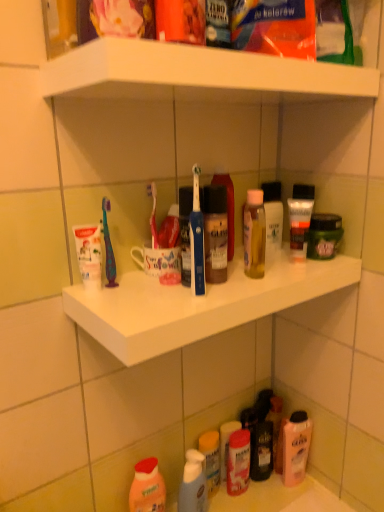
Question: From a real-world perspective, is translucent plastic spray bottle at lower center, the fourth toiletry when ordered from top to bottom, positioned over translucent plastic tube at upper center, positioned as the first toiletry in top-to-bottom order, based on gravity?

Choices:
 (A) no
 (B) yes

Answer: (A)

Question: Does translucent plastic spray bottle at lower center, the fourth toiletry when ordered from top to bottom, have a lesser height compared to translucent plastic tube at upper center, the third toiletry from the left?

Choices:
 (A) yes
 (B) no

Answer: (B)

Question: Does translucent plastic spray bottle at lower center, the first toiletry in the left-to-right sequence, have a smaller size compared to translucent plastic tube at upper center, the 2th toiletry in the right-to-left sequence?

Choices:
 (A) no
 (B) yes

Answer: (A)

Question: Is translucent plastic spray bottle at lower center, which is the fourth toiletry in right-to-left order, aimed at translucent plastic tube at upper center, positioned as the 4th toiletry in bottom-to-top order?

Choices:
 (A) yes
 (B) no

Answer: (B)

Question: Would you say translucent plastic spray bottle at lower center, the fourth toiletry when ordered from top to bottom, is outside translucent plastic tube at upper center, the third toiletry from the left?

Choices:
 (A) no
 (B) yes

Answer: (B)

Question: Is translucent plastic spray bottle at lower center, the fourth toiletry when ordered from top to bottom, bigger than translucent plastic tube at upper center, positioned as the 4th toiletry in bottom-to-top order?

Choices:
 (A) no
 (B) yes

Answer: (B)

Question: Can you confirm if translucent plastic tube at upper center, positioned as the 4th toiletry in bottom-to-top order, is bigger than translucent plastic spray bottle at lower center, the fourth toiletry when ordered from top to bottom?

Choices:
 (A) no
 (B) yes

Answer: (A)

Question: Does translucent plastic tube at upper center, the 2th toiletry in the right-to-left sequence, touch translucent plastic spray bottle at lower center, which is the fourth toiletry in right-to-left order?

Choices:
 (A) no
 (B) yes

Answer: (A)

Question: Is translucent plastic tube at upper center, the third toiletry from the left, positioned with its back to translucent plastic spray bottle at lower center, the fourth toiletry when ordered from top to bottom?

Choices:
 (A) no
 (B) yes

Answer: (A)

Question: Is translucent plastic tube at upper center, positioned as the 4th toiletry in bottom-to-top order, further to camera compared to translucent plastic spray bottle at lower center, the 1th toiletry in the bottom-to-top sequence?

Choices:
 (A) yes
 (B) no

Answer: (B)

Question: Is translucent plastic tube at upper center, the 2th toiletry in the right-to-left sequence, positioned in front of translucent plastic spray bottle at lower center, the first toiletry in the left-to-right sequence?

Choices:
 (A) no
 (B) yes

Answer: (B)

Question: From the image's perspective, does translucent plastic tube at upper center, positioned as the first toiletry in top-to-bottom order, appear higher than translucent plastic spray bottle at lower center, the fourth toiletry when ordered from top to bottom?

Choices:
 (A) yes
 (B) no

Answer: (A)

Question: Is white glossy shelf at upper center positioned with its back to translucent plastic bottle at lower center, which ranks as the 2th cleaning product in right-to-left order?

Choices:
 (A) no
 (B) yes

Answer: (A)